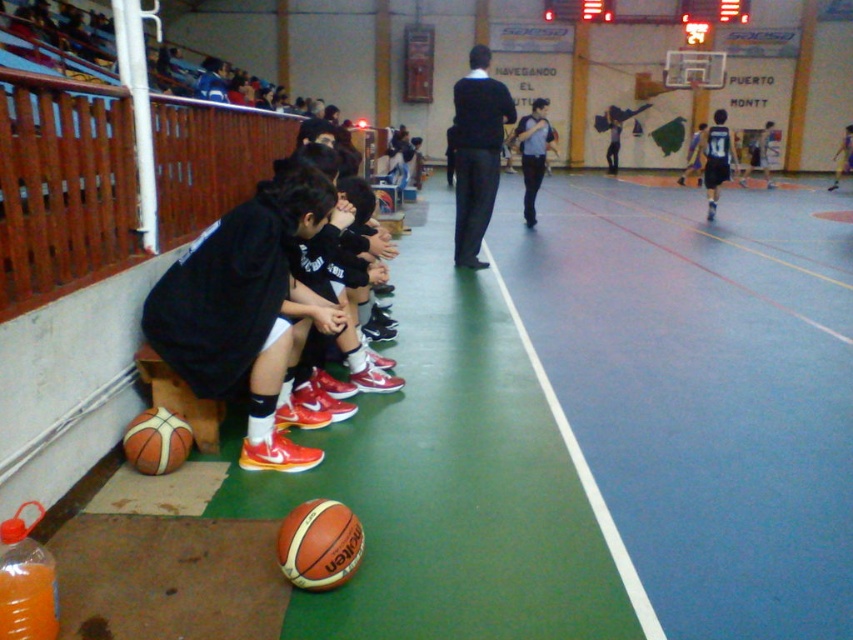
Question: Can you confirm if orange leather basketball at lower left is thinner than leather textured basketball at lower left?

Choices:
 (A) yes
 (B) no

Answer: (A)

Question: Considering the real-world distances, which object is closest to the black matte jacket at center?

Choices:
 (A) leather textured basketball at lower left
 (B) orange leather basketball at lower left
 (C) green rubber line at center

Answer: (A)

Question: Is black matte jacket at center wider than leather textured basketball at lower left?

Choices:
 (A) yes
 (B) no

Answer: (A)

Question: Which point is farther to the camera?

Choices:
 (A) black matte jacket at center
 (B) green rubber line at center

Answer: (A)

Question: Among these points, which one is nearest to the camera?

Choices:
 (A) (146, 440)
 (B) (486, 252)

Answer: (A)

Question: Does black matte jacket at center have a smaller size compared to leather textured basketball at lower left?

Choices:
 (A) no
 (B) yes

Answer: (A)